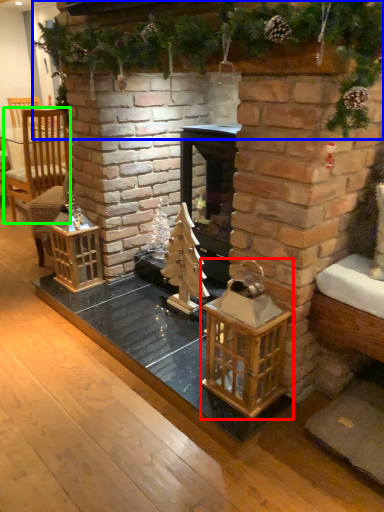
Question: Considering the real-world distances, which object is closest to cage (highlighted by a red box)? christmas decoration (highlighted by a blue box) or armchair (highlighted by a green box).

Choices:
 (A) christmas decoration
 (B) armchair

Answer: (A)